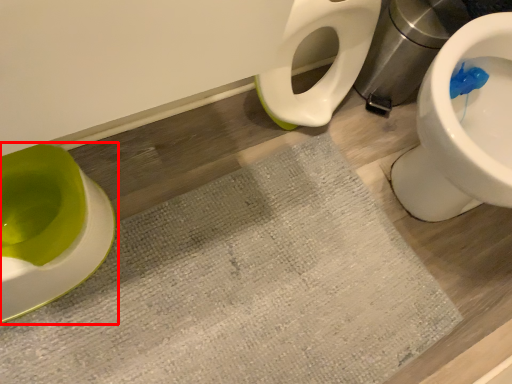
Question: From the image's perspective, where is toilet (annotated by the red box) located in relation to bath mat in the image?

Choices:
 (A) above
 (B) below

Answer: (A)